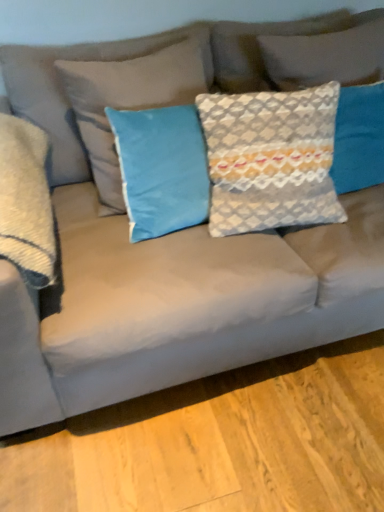
Question: Can you confirm if satin gray pillow at left, acting as the 1th pillow starting from the left, is thinner than textured gray pillow at upper right, the first pillow when ordered from right to left?

Choices:
 (A) no
 (B) yes

Answer: (A)

Question: Would you say satin gray pillow at left, the fourth pillow positioned from the right, is a long distance from textured gray pillow at upper right, which is counted as the 4th pillow, starting from the left?

Choices:
 (A) yes
 (B) no

Answer: (A)

Question: From the image's perspective, is satin gray pillow at left, acting as the 1th pillow starting from the left, below textured gray pillow at upper right, which is counted as the 4th pillow, starting from the left?

Choices:
 (A) yes
 (B) no

Answer: (A)

Question: Is satin gray pillow at left, the fourth pillow positioned from the right, bigger than textured gray pillow at upper right, which is counted as the 4th pillow, starting from the left?

Choices:
 (A) yes
 (B) no

Answer: (A)

Question: Is satin gray pillow at left, acting as the 1th pillow starting from the left, aimed at textured gray pillow at upper right, the first pillow when ordered from right to left?

Choices:
 (A) yes
 (B) no

Answer: (B)

Question: Can you confirm if satin gray pillow at left, the fourth pillow positioned from the right, is taller than textured gray pillow at upper right, the first pillow when ordered from right to left?

Choices:
 (A) no
 (B) yes

Answer: (B)

Question: Can you confirm if blue velvet pillow at center, placed as the 2th pillow when sorted from left to right, is positioned to the right of satin gray pillow at left, the fourth pillow positioned from the right?

Choices:
 (A) no
 (B) yes

Answer: (B)

Question: From the image's perspective, is blue velvet pillow at center, placed as the 2th pillow when sorted from left to right, below satin gray pillow at left, the fourth pillow positioned from the right?

Choices:
 (A) yes
 (B) no

Answer: (B)

Question: Does blue velvet pillow at center, marked as the 3th pillow in a right-to-left arrangement, appear on the left side of satin gray pillow at left, the fourth pillow positioned from the right?

Choices:
 (A) yes
 (B) no

Answer: (B)

Question: Considering the relative sizes of blue velvet pillow at center, marked as the 3th pillow in a right-to-left arrangement, and satin gray pillow at left, acting as the 1th pillow starting from the left, in the image provided, is blue velvet pillow at center, marked as the 3th pillow in a right-to-left arrangement, thinner than satin gray pillow at left, acting as the 1th pillow starting from the left,?

Choices:
 (A) yes
 (B) no

Answer: (A)

Question: Is blue velvet pillow at center, marked as the 3th pillow in a right-to-left arrangement, oriented towards satin gray pillow at left, acting as the 1th pillow starting from the left?

Choices:
 (A) no
 (B) yes

Answer: (A)

Question: Is satin gray pillow at left, the fourth pillow positioned from the right, completely or partially inside blue velvet pillow at center, marked as the 3th pillow in a right-to-left arrangement?

Choices:
 (A) yes
 (B) no

Answer: (B)

Question: Is blue velvet pillow at center, marked as the 3th pillow in a right-to-left arrangement, bigger than textured gray pillow at center, the third pillow when ordered from left to right?

Choices:
 (A) yes
 (B) no

Answer: (A)